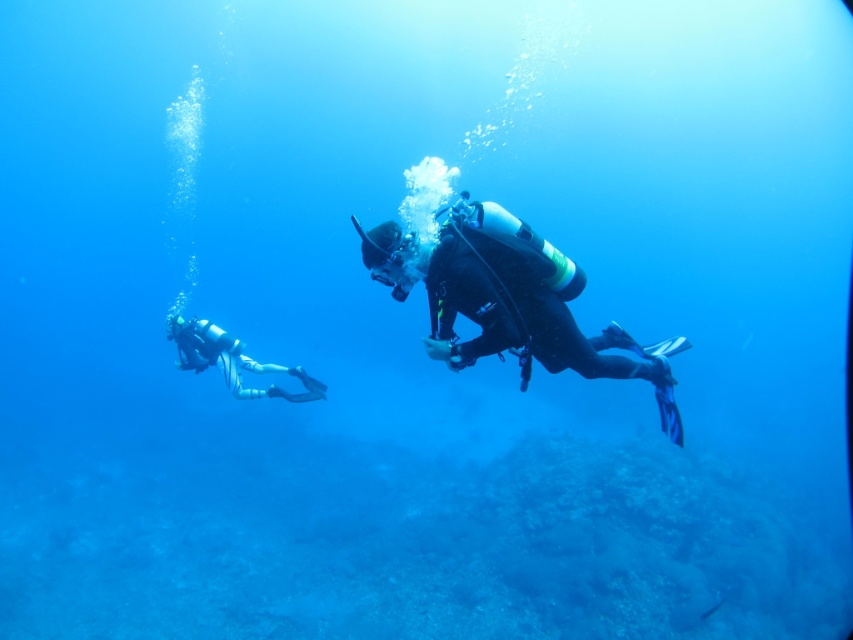
Question: Is black matte scuba diver at center closer to the viewer compared to white matte scuba diver at lower left?

Choices:
 (A) yes
 (B) no

Answer: (A)

Question: Is black matte scuba diver at center bigger than white matte scuba diver at lower left?

Choices:
 (A) yes
 (B) no

Answer: (A)

Question: Which of the following is the closest to the observer?

Choices:
 (A) black matte scuba diver at center
 (B) white matte scuba diver at lower left

Answer: (A)

Question: Among these objects, which one is farthest from the camera?

Choices:
 (A) black matte scuba diver at center
 (B) white matte scuba diver at lower left

Answer: (B)

Question: Does black matte scuba diver at center have a greater width compared to white matte scuba diver at lower left?

Choices:
 (A) yes
 (B) no

Answer: (A)